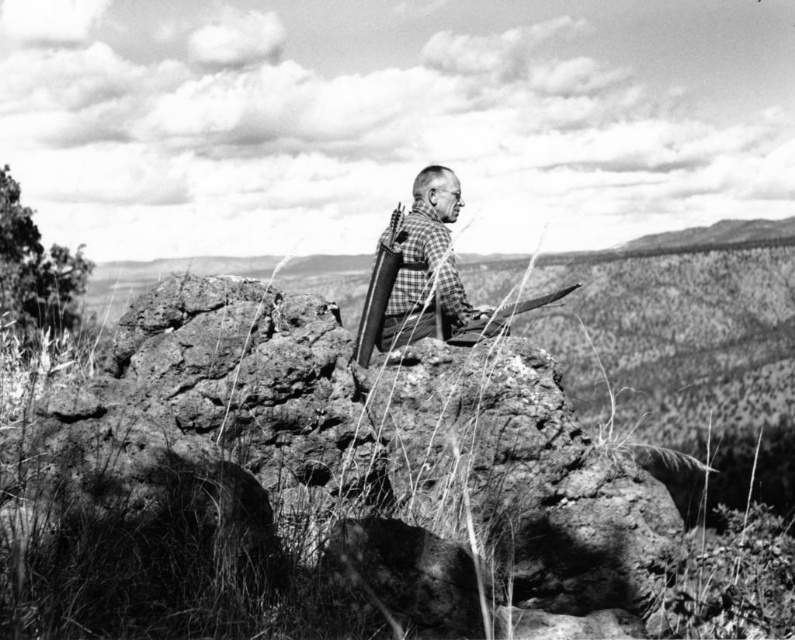
Based on the scene description, what object is located at the coordinate point (x=324, y=481)?

The point (x=324, y=481) corresponds to the rough textured rock at center.

You are a hiker who needs to place a 1.2 meter long tent between the rough textured rock at center and the polished metal rifle at center. Is there enough space between them to fit your tent?

The distance between the rough textured rock at center and the polished metal rifle at center is 1.05 meters, which is shorter than the 1.2 meter long tent. Therefore, the tent cannot fit between them.